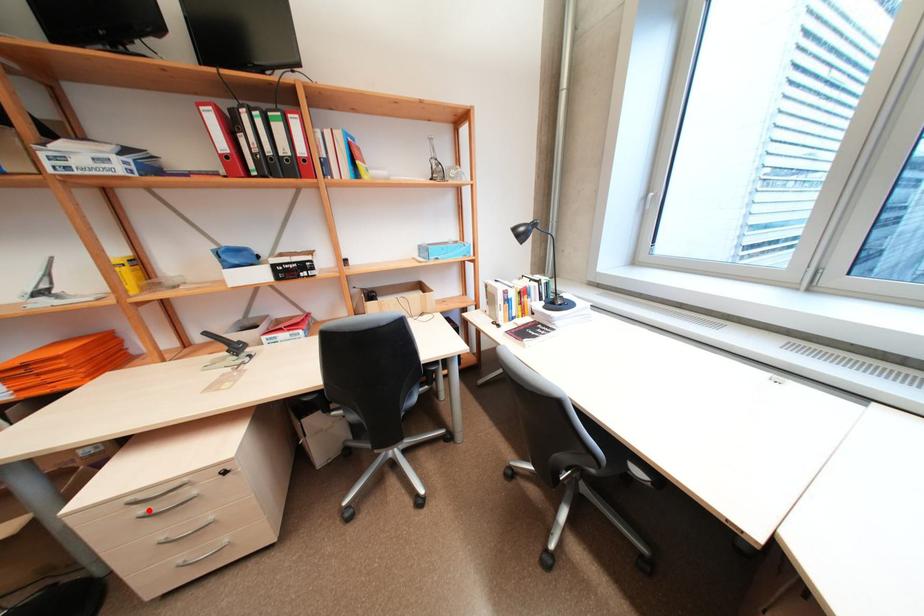
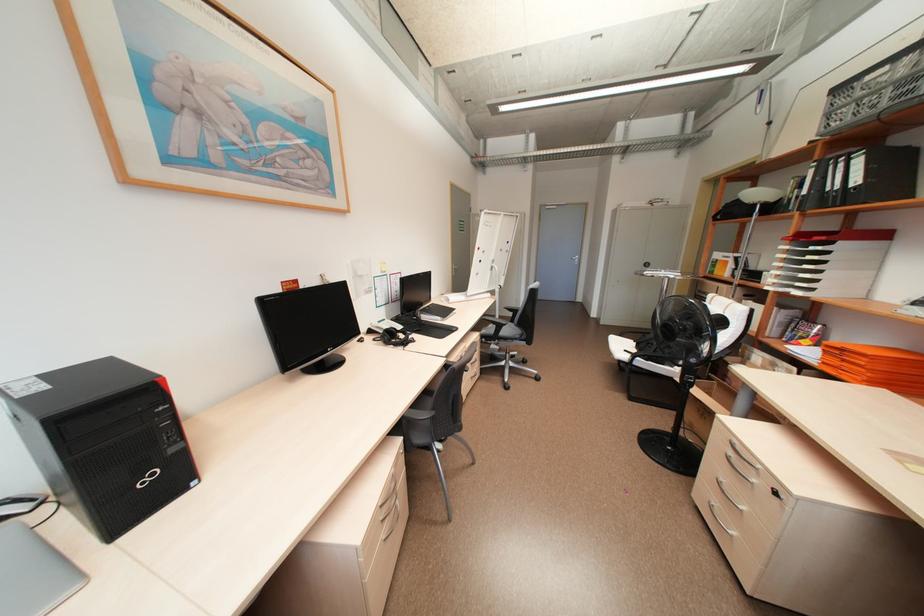
Locate, in the second image, the point that corresponds to the highlighted location in the first image.

(736, 453)